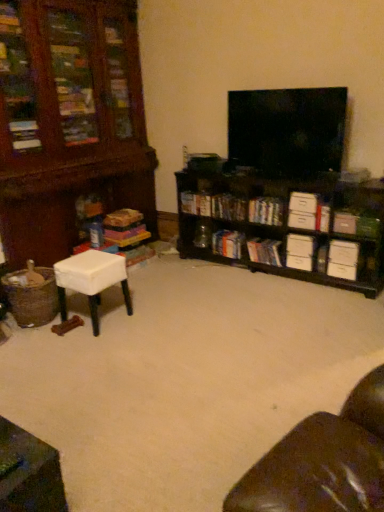
Question: From a real-world perspective, is white fabric stool at lower left, the 2th table in the bottom-to-top sequence, under hardcover books at center, placed as the second book when sorted from left to right?

Choices:
 (A) no
 (B) yes

Answer: (B)

Question: Does white fabric stool at lower left, the 2th table in the bottom-to-top sequence, have a greater width compared to hardcover books at center, placed as the second book when sorted from left to right?

Choices:
 (A) no
 (B) yes

Answer: (B)

Question: Can you confirm if white fabric stool at lower left, the 1th table in the back-to-front sequence, is bigger than hardcover books at center, marked as the sixth book in a right-to-left arrangement?

Choices:
 (A) no
 (B) yes

Answer: (B)

Question: Is white fabric stool at lower left, the 1th table in the back-to-front sequence, far from hardcover books at center, marked as the sixth book in a right-to-left arrangement?

Choices:
 (A) no
 (B) yes

Answer: (B)

Question: Considering the relative sizes of white fabric stool at lower left, which ranks as the 1th table in top-to-bottom order, and hardcover books at center, marked as the sixth book in a right-to-left arrangement, in the image provided, is white fabric stool at lower left, which ranks as the 1th table in top-to-bottom order, thinner than hardcover books at center, marked as the sixth book in a right-to-left arrangement,?

Choices:
 (A) no
 (B) yes

Answer: (A)

Question: From the image's perspective, is white fabric stool at lower left, the 2th table in the bottom-to-top sequence, on hardcover books at center, placed as the second book when sorted from left to right?

Choices:
 (A) no
 (B) yes

Answer: (A)

Question: Is hardcover book at center, which ranks as the third book in left-to-right order, closer to camera compared to white cardboard box at right, the 6th book positioned from the left?

Choices:
 (A) no
 (B) yes

Answer: (A)

Question: Can you confirm if hardcover book at center, which ranks as the third book in left-to-right order, is wider than white cardboard box at right, the 6th book positioned from the left?

Choices:
 (A) no
 (B) yes

Answer: (B)

Question: From the image's perspective, is hardcover book at center, which ranks as the third book in left-to-right order, on white cardboard box at right, marked as the second book in a right-to-left arrangement?

Choices:
 (A) yes
 (B) no

Answer: (B)

Question: From the image's perspective, does hardcover book at center, placed as the fifth book when sorted from right to left, appear lower than white cardboard box at right, marked as the second book in a right-to-left arrangement?

Choices:
 (A) no
 (B) yes

Answer: (B)

Question: Is hardcover book at center, which ranks as the third book in left-to-right order, thinner than white cardboard box at right, the 6th book positioned from the left?

Choices:
 (A) no
 (B) yes

Answer: (A)

Question: Could you tell me if hardcover books at center, the fourth book from the left, is turned towards hardcover book at center, which ranks as the third book in left-to-right order?

Choices:
 (A) yes
 (B) no

Answer: (B)